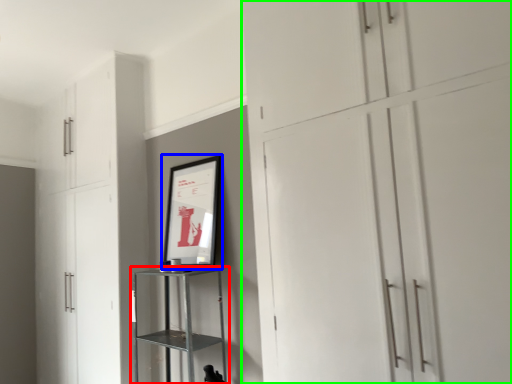
Question: Considering the real-world distances, which object is closest to shelf (highlighted by a red box)? picture frame (highlighted by a blue box) or cupboard (highlighted by a green box).

Choices:
 (A) picture frame
 (B) cupboard

Answer: (A)